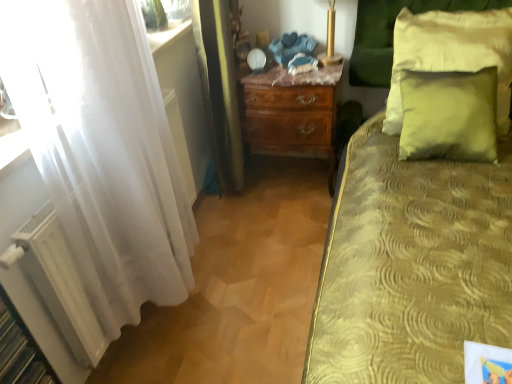
This screenshot has height=384, width=512. Find the location of `free space in front of mahogany wood nightstand at center`. free space in front of mahogany wood nightstand at center is located at coordinates (288, 219).